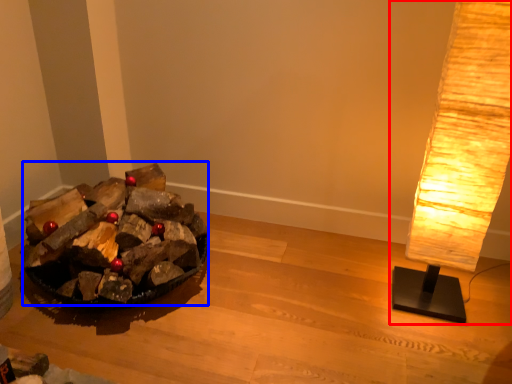
Question: Which object is closer to the camera taking this photo, lamp (highlighted by a red box) or debris (highlighted by a blue box)?

Choices:
 (A) lamp
 (B) debris

Answer: (A)